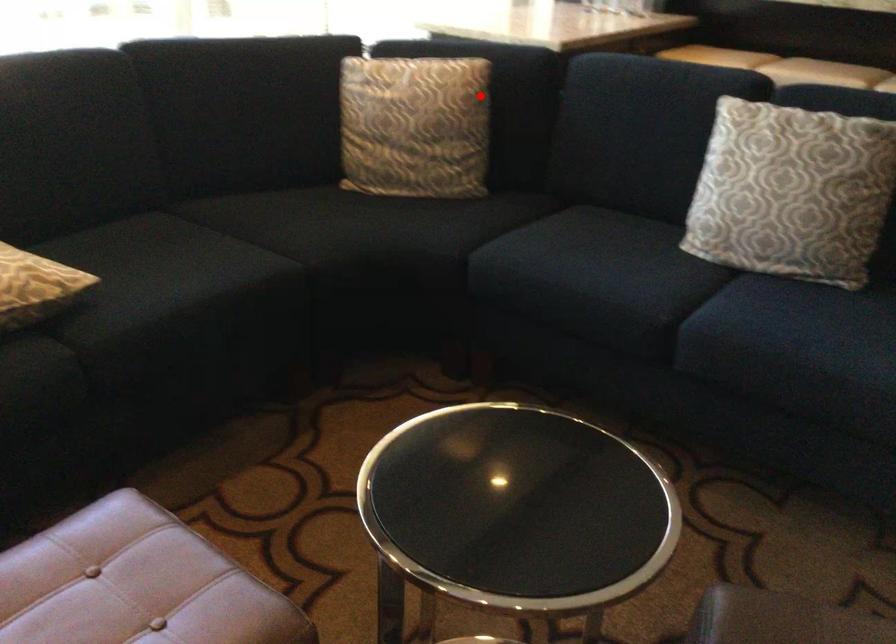
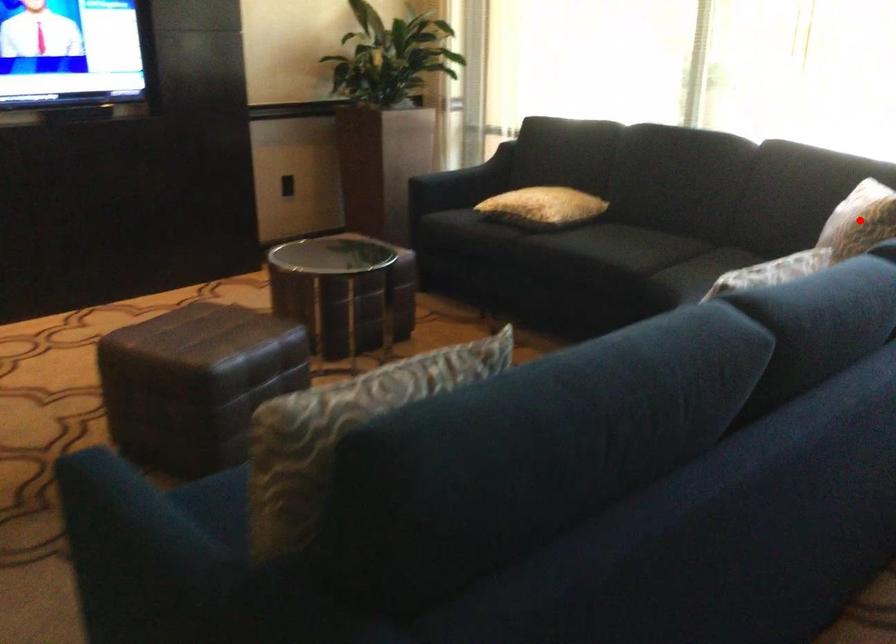
I am providing you with two images of the same scene from different viewpoints. A red point is marked on the first image and another point is marked on the second image. Is the red point in image1 aligned with the point shown in image2?

Yes